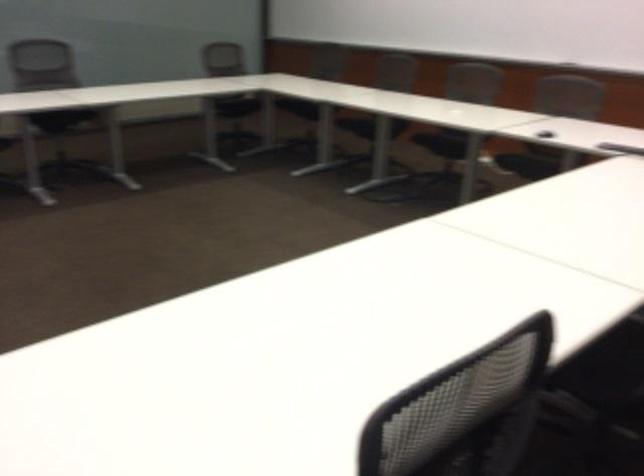
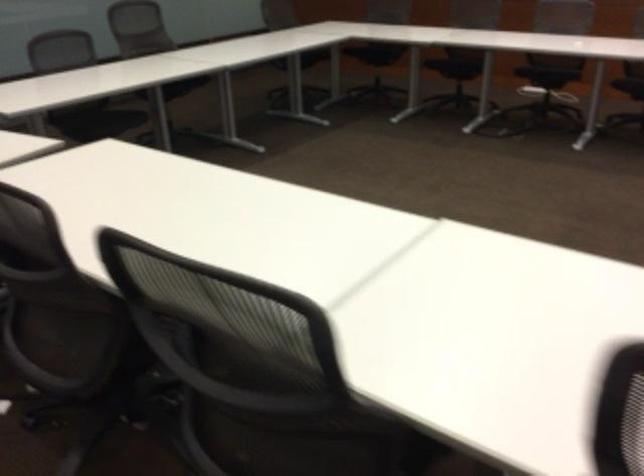
The images are taken continuously from a first-person perspective. In which direction is your viewpoint rotating?

The camera's rotation is toward right-down.